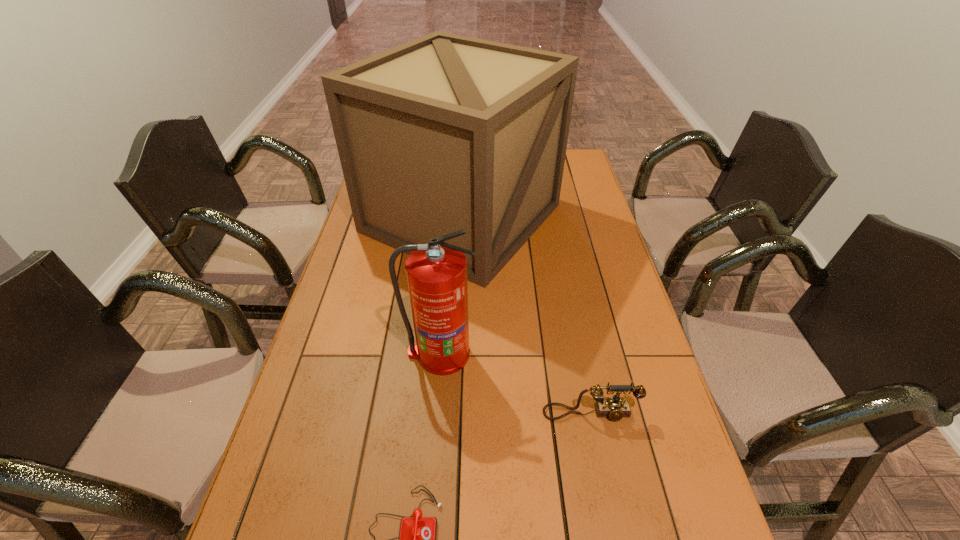
This screenshot has width=960, height=540. Identify the location of object that is at the left edge. (446, 132).

This screenshot has height=540, width=960. I want to click on box at the right edge, so click(446, 132).

This screenshot has height=540, width=960. Find the location of `telephone that is positioned at the right edge`. telephone that is positioned at the right edge is located at coordinates (614, 408).

The height and width of the screenshot is (540, 960). Find the location of `object that is at the far left corner`. object that is at the far left corner is located at coordinates (446, 132).

In order to click on object present at the far right corner in this screenshot , I will do click(x=446, y=132).

Where is `free point at the left edge`? The width and height of the screenshot is (960, 540). free point at the left edge is located at coordinates (351, 234).

Locate an element on the screen. blank space at the right edge of the desktop is located at coordinates (600, 304).

Identify the location of unoccupied position between the tallest object and the taller telephone. (526, 315).

At what (x,y) coordinates should I click in order to perform the action: click on free space between the third farthest object and the fire extinguisher. Please return your answer as a coordinate pair (x, y). Looking at the image, I should click on (516, 383).

Image resolution: width=960 pixels, height=540 pixels. I want to click on free space that is in between the taller telephone and the farthest object, so click(x=526, y=315).